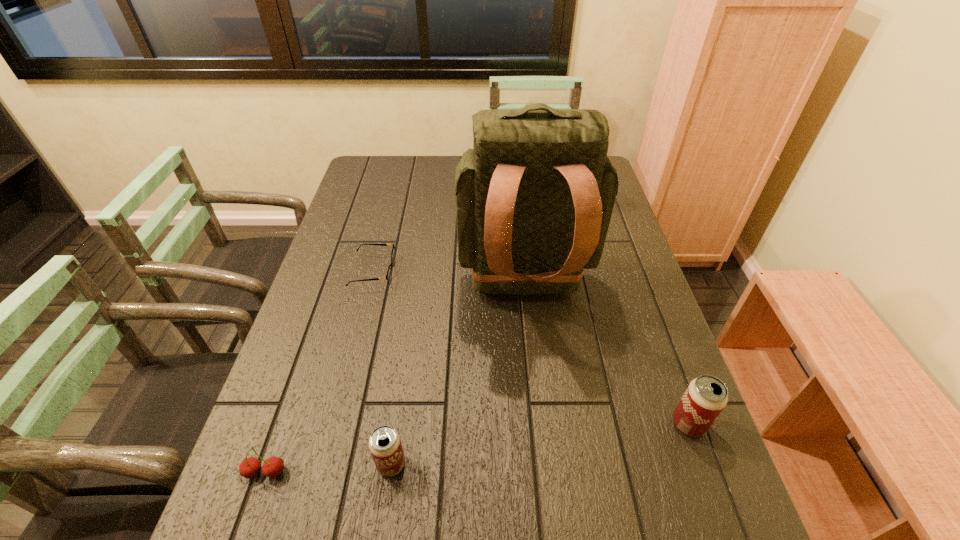
The width and height of the screenshot is (960, 540). What are the coordinates of `vacant space at the far edge of the desktop` in the screenshot? It's located at (406, 164).

The width and height of the screenshot is (960, 540). Identify the location of vacant space at the near edge of the desktop. click(x=558, y=492).

The image size is (960, 540). Identify the location of blank space at the left edge of the desktop. (356, 215).

This screenshot has height=540, width=960. What are the coordinates of `free space at the right edge of the desktop` in the screenshot? It's located at (664, 413).

Find the location of a particular element. The height and width of the screenshot is (540, 960). vacant space at the far left corner of the desktop is located at coordinates (391, 183).

The height and width of the screenshot is (540, 960). I want to click on vacant space that is in between the cherry and the backpack, so click(x=395, y=382).

The height and width of the screenshot is (540, 960). Identify the location of blank region between the spectacles and the right beer can. (531, 348).

Find the location of a particular element. blank region between the left beer can and the leftmost object is located at coordinates (328, 468).

I want to click on vacant area between the leftmost object and the third object from left to right, so click(328, 468).

Where is `free spot between the third farthest object and the third object from left to right`? free spot between the third farthest object and the third object from left to right is located at coordinates (540, 444).